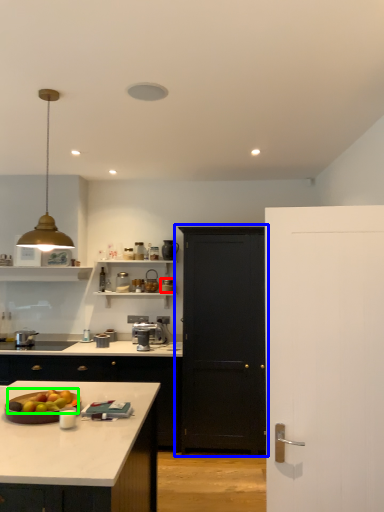
Question: Which object is positioned closest to appliance (highlighted by a red box)? Select from door (highlighted by a blue box) and apple (highlighted by a green box).

Choices:
 (A) door
 (B) apple

Answer: (A)